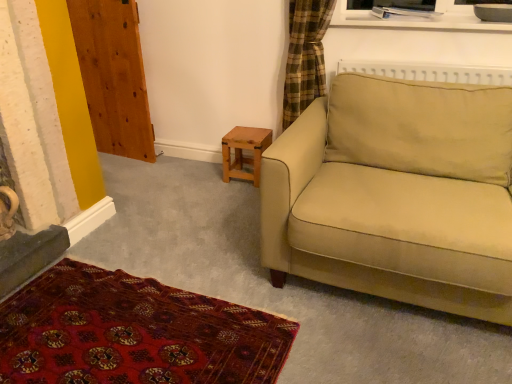
Find the location of a particular element. This screenshot has height=384, width=512. vacant space in front of wooden stool at lower center is located at coordinates (234, 187).